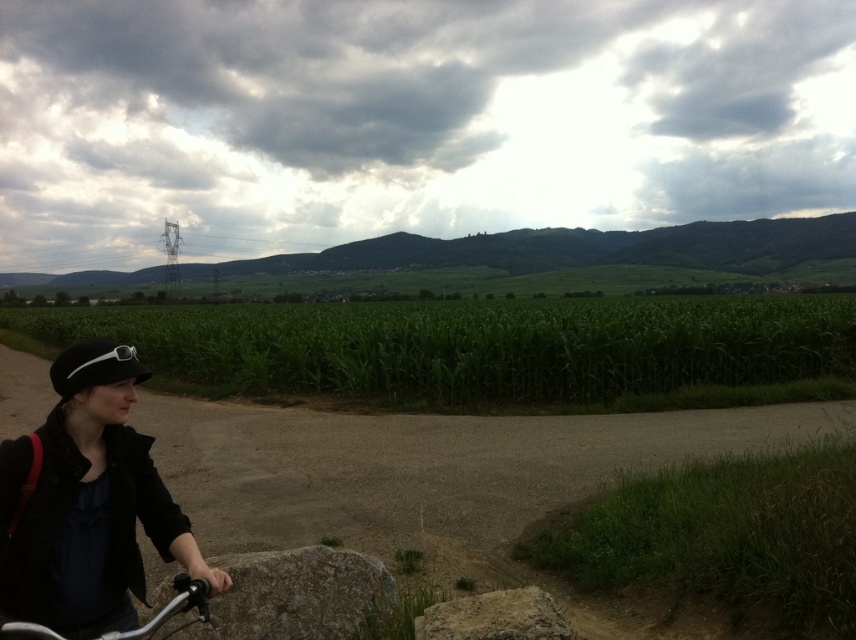
You are a hiker standing at the gray rough stone at lower center. Which direction should you walk to reach the green leafy corn at center?

The green leafy corn at center is located to the right of the gray rough stone at lower center, so you should walk to the right to reach it.

You are standing at the rough textured rock at lower center and want to reach the silver metallic bicycle at lower left. Which direction should you move to get closer to the bicycle?

Since the rough textured rock at lower center is further to the viewer than the silver metallic bicycle at lower left, you should move backward to reach the bicycle.

You are a hiker trying to navigate through this rural area. You notice the gray rough stone at lower center and the silver metallic bicycle at lower left. Which object is shorter in height?

The gray rough stone at lower center is not as tall as the silver metallic bicycle at lower left, so the gray rough stone at lower center is shorter in height.